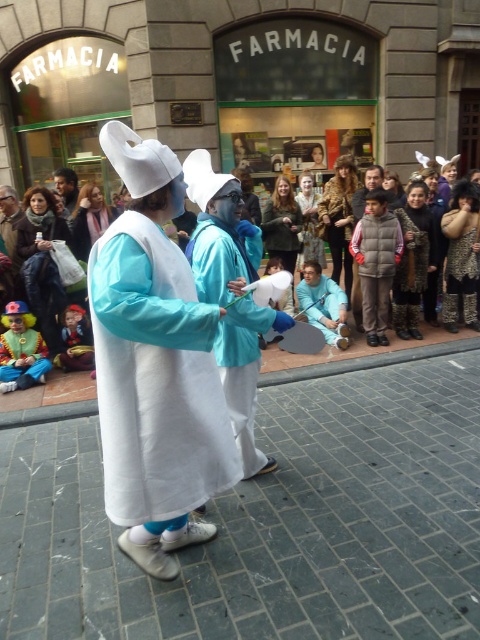
Question: Which object is closer to the camera taking this photo?

Choices:
 (A) matte white coat at center
 (B) white fabric at center
 (C) white matte vest at center
 (D) matte blue coat at center

Answer: (C)

Question: Which point is farther from the camera taking this photo?

Choices:
 (A) (78, 394)
 (B) (93, 476)
 (C) (69, 212)
 (D) (208, 204)

Answer: (C)

Question: Which point is farther to the camera?

Choices:
 (A) white fabric at center
 (B) white matte vest at center
 (C) gray puffy vest at center
 (D) matte white coat at center

Answer: (C)

Question: Can you confirm if matte blue coat at center is smaller than matte white coat at center?

Choices:
 (A) yes
 (B) no

Answer: (B)

Question: Is white fabric at center thinner than matte white mask at center?

Choices:
 (A) yes
 (B) no

Answer: (B)

Question: Is white fabric at center bigger than matte white coat at center?

Choices:
 (A) yes
 (B) no

Answer: (A)